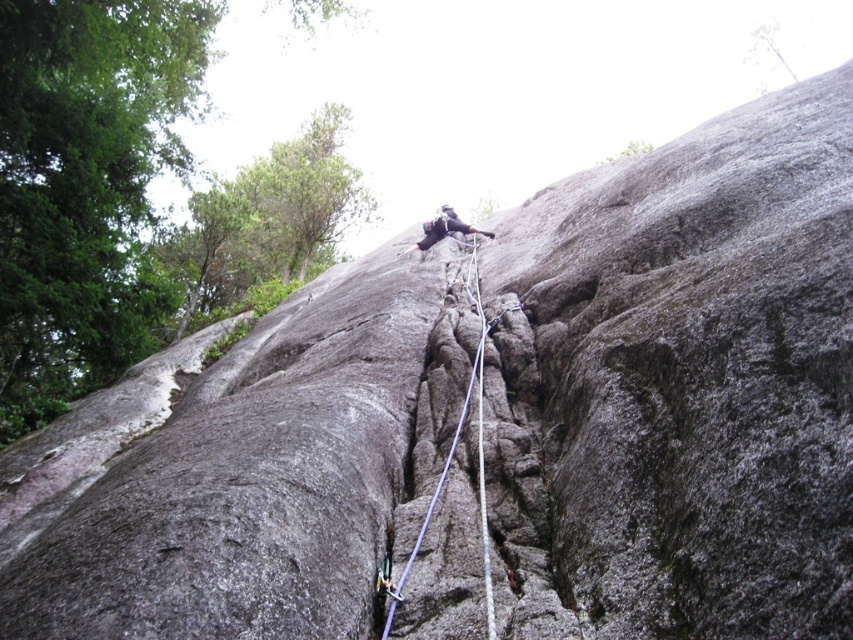
Question: Among these objects, which one is nearest to the camera?

Choices:
 (A) dark gray climbing gear at center
 (B) purple nylon rope at center

Answer: (B)

Question: Does purple nylon rope at center have a smaller size compared to dark gray climbing gear at center?

Choices:
 (A) yes
 (B) no

Answer: (A)

Question: Does purple nylon rope at center lie behind dark gray climbing gear at center?

Choices:
 (A) no
 (B) yes

Answer: (A)

Question: Which point is farther to the camera?

Choices:
 (A) (457, 225)
 (B) (485, 513)

Answer: (A)

Question: Is purple nylon rope at center thinner than dark gray climbing gear at center?

Choices:
 (A) no
 (B) yes

Answer: (B)